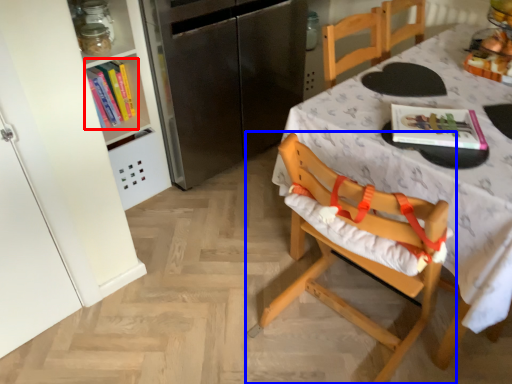
Question: Which object appears farthest to the camera in this image, book (highlighted by a red box) or chair (highlighted by a blue box)?

Choices:
 (A) book
 (B) chair

Answer: (A)